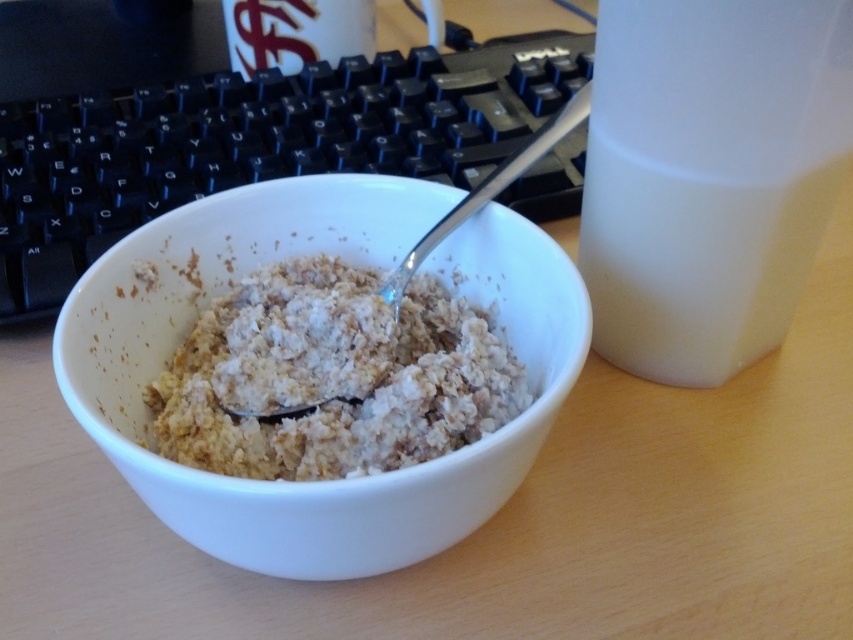
You are organizing your desk and want to place both the black plastic keyboard at center and the white textured cereal at center into a drawer. The drawer has a maximum capacity of 1000 cubic centimeters. If the keyboard occupies 800 cubic centimeters and the cereal takes up 300 cubic centimeters, will both items fit together?

The black plastic keyboard at center occupies 800 cubic centimeters and the white textured cereal at center takes up 300 cubic centimeters. Combined, they total 1100 cubic centimeters, which exceeds the drawer capacity of 1000 cubic centimeters. Therefore, both items cannot fit together.

You are trying to place a small decorative item on the desk. The coordinates of the black plastic keyboard at center are given as point (254, 144). Where should you place the item to ensure it is not directly on top of the keyboard?

Place the item anywhere except at the coordinates point (254, 144) where the black plastic keyboard at center is located.

In the scene shown: You are a photographer adjusting your camera to focus on two points in the image. The first point is labeled as point (x=270, y=184) and the second is point (x=556, y=38). Which point should you focus on first if you want to ensure the closest object is in sharp focus?

Point (x=270, y=184) is closer to the camera than point (x=556, y=38), so you should focus on point (x=270, y=184) first to ensure the closest object is in sharp focus.